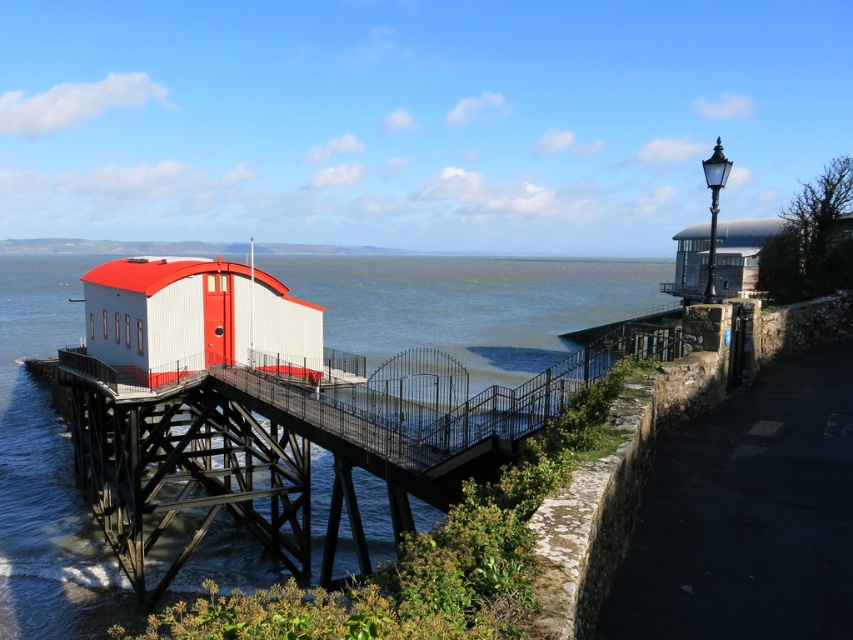
Which is below, white matte bridge at center or matte white and red beach hut at center?

Positioned lower is white matte bridge at center.

Is the position of white matte bridge at center less distant than that of matte white and red beach hut at center?

That is True.

The height and width of the screenshot is (640, 853). What are the coordinates of `white matte bridge at center` in the screenshot? It's located at (299, 448).

Image resolution: width=853 pixels, height=640 pixels. Identify the location of white matte bridge at center. (299, 448).

Does matte white and red beach hut at center have a lesser height compared to metallic silver building at upper right?

Yes.

Does point (138, 353) lie behind point (704, 273)?

No.

Between point (183, 285) and point (694, 240), which one is positioned behind?

The point (694, 240) is more distant.

I want to click on matte white and red beach hut at center, so click(189, 317).

Does white matte bridge at center appear on the right side of metallic silver building at upper right?

In fact, white matte bridge at center is to the left of metallic silver building at upper right.

The image size is (853, 640). What do you see at coordinates (299, 448) in the screenshot?
I see `white matte bridge at center` at bounding box center [299, 448].

Find the location of a particular element. white matte bridge at center is located at coordinates (299, 448).